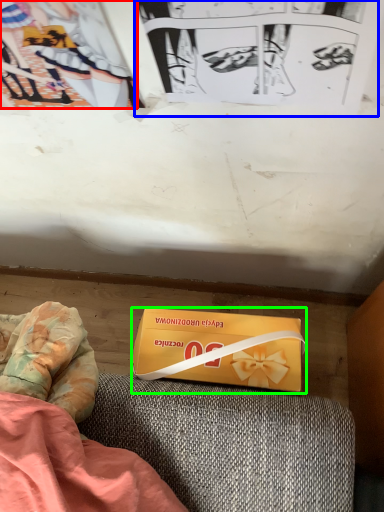
Question: Which object is positioned farthest from couple (highlighted by a red box)? Select from paperback book (highlighted by a blue box) and box (highlighted by a green box).

Choices:
 (A) paperback book
 (B) box

Answer: (B)